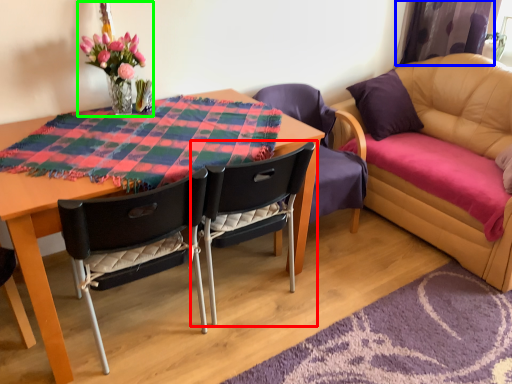
Question: Considering the real-world distances, which object is farthest from chair (highlighted by a red box)? curtain (highlighted by a blue box) or floral arrangement (highlighted by a green box)?

Choices:
 (A) curtain
 (B) floral arrangement

Answer: (A)